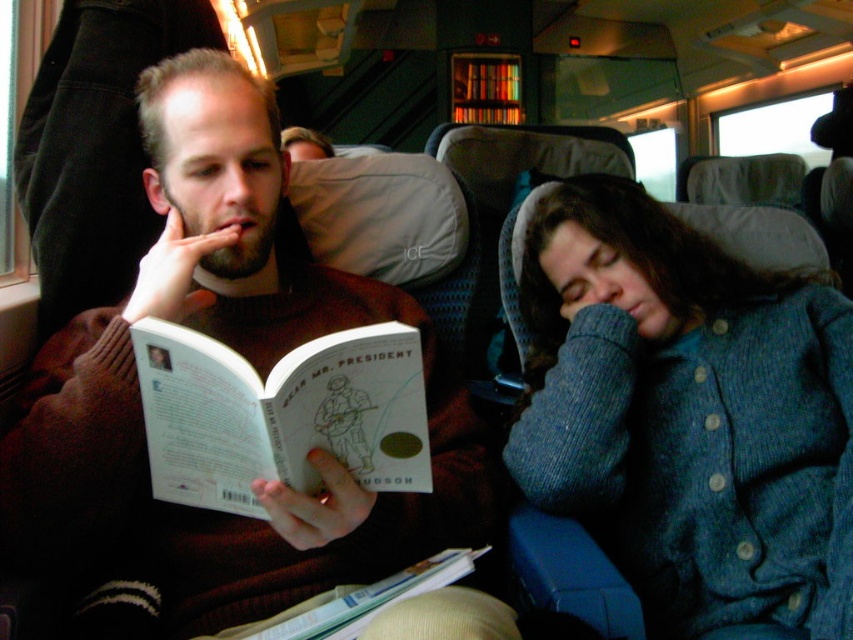
Which is above, brown sweater at left or hardcover book at center?

brown sweater at left

Is point (49, 506) positioned in front of point (358, 596)?

Yes.

The width and height of the screenshot is (853, 640). Describe the element at coordinates (252, 365) in the screenshot. I see `brown sweater at left` at that location.

At what (x,y) coordinates should I click in order to perform the action: click on brown sweater at left. Please return your answer as a coordinate pair (x, y). Looking at the image, I should click on (252, 365).

Between knitted blue sweater at right and white paper at center, which one is positioned lower?

white paper at center is below.

Between point (706, 426) and point (149, 353), which one is positioned in front?

Point (149, 353) is in front.

You are a GUI agent. You are given a task and a screenshot of the screen. Output one action in this format:
    pyautogui.click(x=<x>, y=<y>)
    Task: Click on the knitted blue sweater at right
    
    Given the screenshot: What is the action you would take?
    (688, 412)

What are the coordinates of `knitted blue sweater at right` in the screenshot? It's located at (688, 412).

Identify the location of knitted blue sweater at right. (688, 412).